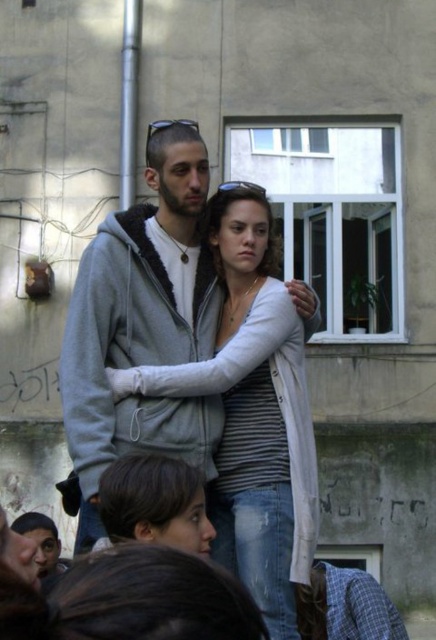
Question: Where is striped knit sweater at center located in relation to gray fleece sweatshirt at center in the image?

Choices:
 (A) below
 (B) above

Answer: (B)

Question: Is striped knit sweater at center wider than gray fleece sweatshirt at center?

Choices:
 (A) yes
 (B) no

Answer: (A)

Question: Is striped knit sweater at center below gray fleece sweatshirt at center?

Choices:
 (A) yes
 (B) no

Answer: (B)